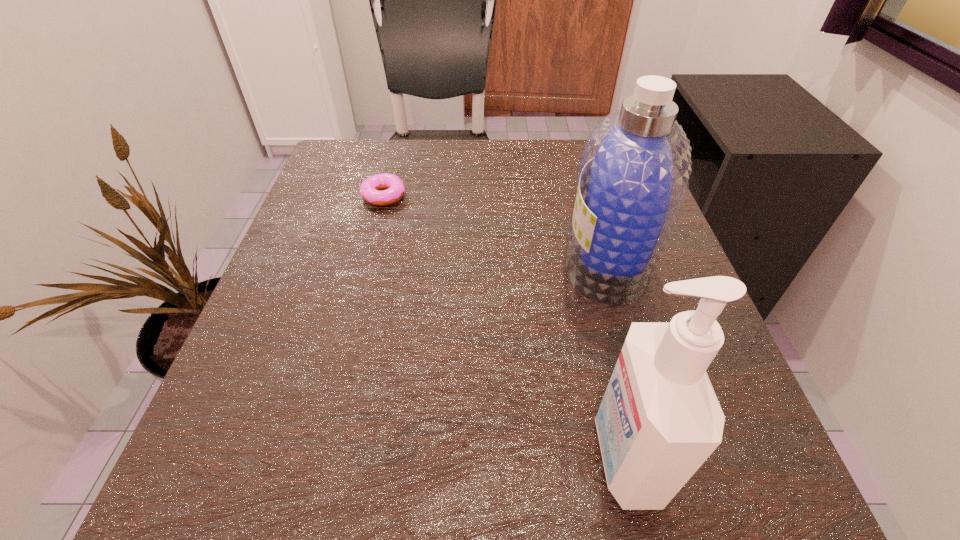
Locate an element on the screen. The image size is (960, 540). object that is positioned at the near edge is located at coordinates click(659, 420).

This screenshot has height=540, width=960. Identify the location of object at the left edge. (394, 186).

This screenshot has height=540, width=960. I want to click on object present at the far left corner, so [x=394, y=186].

I want to click on object located in the near right corner section of the desktop, so click(x=659, y=420).

In the image, there is a desktop. Where is `free space at the far edge`? free space at the far edge is located at coordinates (412, 178).

The height and width of the screenshot is (540, 960). In the image, there is a desktop. Find the location of `vacant area at the near edge`. vacant area at the near edge is located at coordinates (488, 456).

Find the location of a particular element. The width and height of the screenshot is (960, 540). vacant space at the left edge is located at coordinates (344, 256).

Locate an element on the screen. vacant space at the far left corner is located at coordinates 341,177.

Find the location of a particular element. The image size is (960, 540). free spot between the second farthest object and the shortest object is located at coordinates (495, 230).

What are the coordinates of `empty space between the shortest object and the nearest object` in the screenshot? It's located at (504, 326).